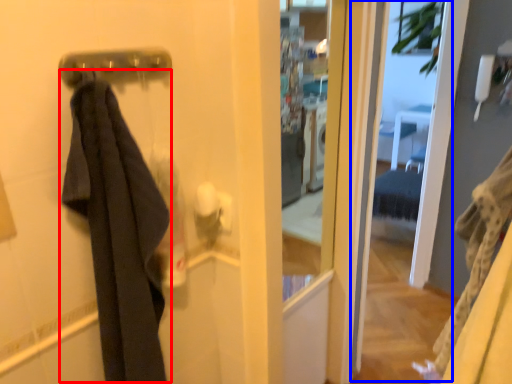
Question: Which object appears closest to the camera in this image, clothing (highlighted by a red box) or screen door (highlighted by a blue box)?

Choices:
 (A) clothing
 (B) screen door

Answer: (A)